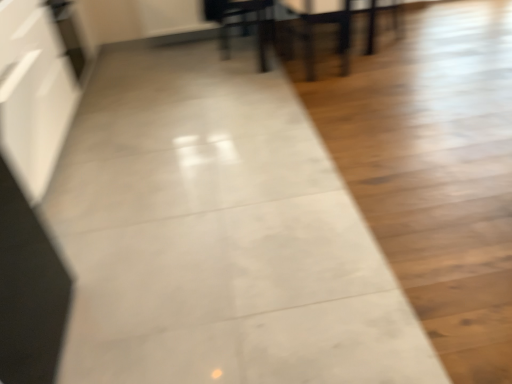
Describe the element at coordinates (241, 23) in the screenshot. This screenshot has width=512, height=384. I see `matte black dining chair at upper center` at that location.

What do you see at coordinates (322, 23) in the screenshot? This screenshot has height=384, width=512. I see `matte black armchair at upper center` at bounding box center [322, 23].

Describe the element at coordinates (338, 32) in the screenshot. The height and width of the screenshot is (384, 512). I see `wooden table at center` at that location.

What do you see at coordinates (375, 21) in the screenshot?
I see `matte black chair at upper right` at bounding box center [375, 21].

Identify the location of matte black dining chair at upper center. Image resolution: width=512 pixels, height=384 pixels. (241, 23).

Between wooden table at center and matte black armchair at upper center, which one has larger size?

wooden table at center.

Locate an element on the screen. The image size is (512, 384). armchair in front of the wooden table at center is located at coordinates click(322, 23).

Is point (274, 23) closer or farther from the camera than point (342, 54)?

Point (274, 23) is positioned farther from the camera compared to point (342, 54).

Is wooden table at center oriented away from matte black armchair at upper center?

No, wooden table at center is not facing the opposite direction of matte black armchair at upper center.

Is the depth of matte black armchair at upper center greater than that of matte black dining chair at upper center?

No, matte black armchair at upper center is closer to the camera.

Is matte black armchair at upper center not near matte black dining chair at upper center?

matte black armchair at upper center is near matte black dining chair at upper center, not far away.

From the image's perspective, is matte black armchair at upper center above matte black dining chair at upper center?

Incorrect, from the image's perspective, matte black armchair at upper center is lower than matte black dining chair at upper center.

Is matte black armchair at upper center thinner than matte black dining chair at upper center?

Correct, the width of matte black armchair at upper center is less than that of matte black dining chair at upper center.

Is there a large distance between wooden table at center and matte black dining chair at upper center?

No, wooden table at center is in close proximity to matte black dining chair at upper center.

Considering the relative sizes of wooden table at center and matte black dining chair at upper center in the image provided, is wooden table at center bigger than matte black dining chair at upper center?

Indeed, wooden table at center has a larger size compared to matte black dining chair at upper center.

In the scene shown: From the image's perspective, which one is positioned lower, wooden table at center or matte black dining chair at upper center?

From the image's view, matte black dining chair at upper center is below.

Could you tell me if matte black dining chair at upper center is turned towards matte black armchair at upper center?

No, matte black dining chair at upper center is not facing towards matte black armchair at upper center.

Which of these two, matte black dining chair at upper center or matte black armchair at upper center, stands taller?

matte black armchair at upper center is taller.

Choose the correct answer: Is matte black dining chair at upper center inside matte black armchair at upper center or outside it?

matte black dining chair at upper center lies outside matte black armchair at upper center.

From the image's perspective, which is above, matte black dining chair at upper center or matte black armchair at upper center?

matte black dining chair at upper center.

Between matte black armchair at upper center and wooden table at center, which one has less height?

wooden table at center.

Which is in front, matte black armchair at upper center or wooden table at center?

matte black armchair at upper center is in front.

Is matte black armchair at upper center facing away from wooden table at center?

matte black armchair at upper center is not turned away from wooden table at center.

Is matte black armchair at upper center smaller than matte black chair at upper right?

No.

Is matte black armchair at upper center next to matte black chair at upper right and touching it?

There is a gap between matte black armchair at upper center and matte black chair at upper right.

From a real-world perspective, is matte black armchair at upper center over matte black chair at upper right?

Yes.

Based on their sizes in the image, would you say matte black chair at upper right is bigger or smaller than matte black armchair at upper center?

In the image, matte black chair at upper right appears to be smaller than matte black armchair at upper center.

From the image's perspective, does matte black chair at upper right appear lower than matte black armchair at upper center?

Incorrect, from the image's perspective, matte black chair at upper right is higher than matte black armchair at upper center.

Is point (371, 49) in front of point (346, 16)?

That is False.

Where is `table behind the matte black armchair at upper center`? The width and height of the screenshot is (512, 384). table behind the matte black armchair at upper center is located at coordinates (338, 32).

At what (x,y) coordinates should I click in order to perform the action: click on armchair in front of the matte black dining chair at upper center. Please return your answer as a coordinate pair (x, y). The image size is (512, 384). Looking at the image, I should click on (322, 23).

Based on their spatial positions, is wooden table at center or matte black dining chair at upper center closer to matte black chair at upper right?

wooden table at center is closer to matte black chair at upper right.

From the image, which object appears to be farther from matte black dining chair at upper center, matte black armchair at upper center or wooden table at center?

Based on the image, matte black armchair at upper center appears to be further to matte black dining chair at upper center.

Looking at the image, which one is located closer to matte black armchair at upper center, matte black chair at upper right or matte black dining chair at upper center?

The object closer to matte black armchair at upper center is matte black dining chair at upper center.

Estimate the real-world distances between objects in this image. Which object is further from matte black armchair at upper center, matte black dining chair at upper center or wooden table at center?

matte black dining chair at upper center is positioned further to the anchor matte black armchair at upper center.

From the image, which object appears to be farther from wooden table at center, matte black armchair at upper center or matte black chair at upper right?

matte black chair at upper right.

When comparing their distances from matte black chair at upper right, does matte black armchair at upper center or wooden table at center seem further?

wooden table at center.

Based on their spatial positions, is matte black chair at upper right or wooden table at center closer to matte black dining chair at upper center?

wooden table at center is positioned closer to the anchor matte black dining chair at upper center.

When comparing their distances from matte black dining chair at upper center, does matte black chair at upper right or matte black armchair at upper center seem closer?

matte black armchair at upper center is positioned closer to the anchor matte black dining chair at upper center.

The width and height of the screenshot is (512, 384). Identify the location of armchair situated between matte black dining chair at upper center and matte black chair at upper right from left to right. (322, 23).

You are a GUI agent. You are given a task and a screenshot of the screen. Output one action in this format:
    pyautogui.click(x=<x>, y=<y>)
    Task: Click on the table situated between matte black dining chair at upper center and matte black chair at upper right from left to right
    Image resolution: width=512 pixels, height=384 pixels.
    Given the screenshot: What is the action you would take?
    pyautogui.click(x=338, y=32)

Identify the location of armchair between wooden table at center and matte black chair at upper right from left to right. (322, 23).

Locate an element on the screen. Image resolution: width=512 pixels, height=384 pixels. table situated between matte black dining chair at upper center and matte black armchair at upper center from left to right is located at coordinates (338, 32).